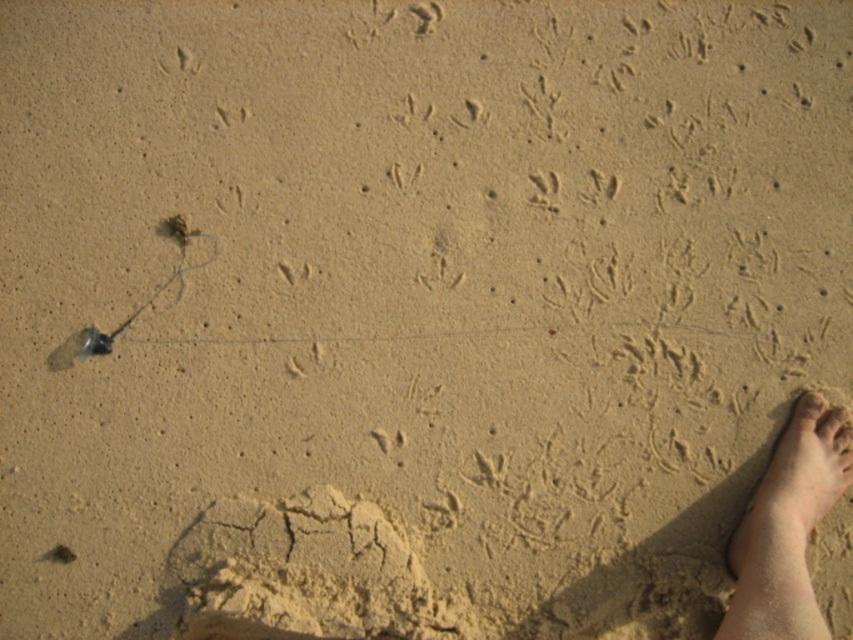
Is point (734, 570) less distant than point (804, 410)?

Yes, it is in front of point (804, 410).

Can you confirm if light skin textured foot at lower right is positioned to the right of smooth skin toe at lower right?

In fact, light skin textured foot at lower right is to the left of smooth skin toe at lower right.

Between point (773, 448) and point (816, 397), which one is positioned behind?

Positioned behind is point (773, 448).

The width and height of the screenshot is (853, 640). In order to click on light skin textured foot at lower right in this screenshot , I will do `click(792, 500)`.